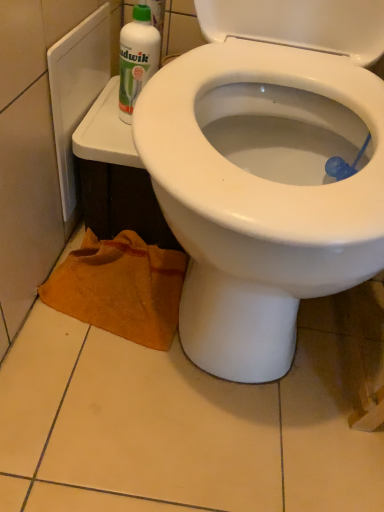
The image size is (384, 512). Find the location of `free space in front of white plastic bottle at upper left`. free space in front of white plastic bottle at upper left is located at coordinates (109, 141).